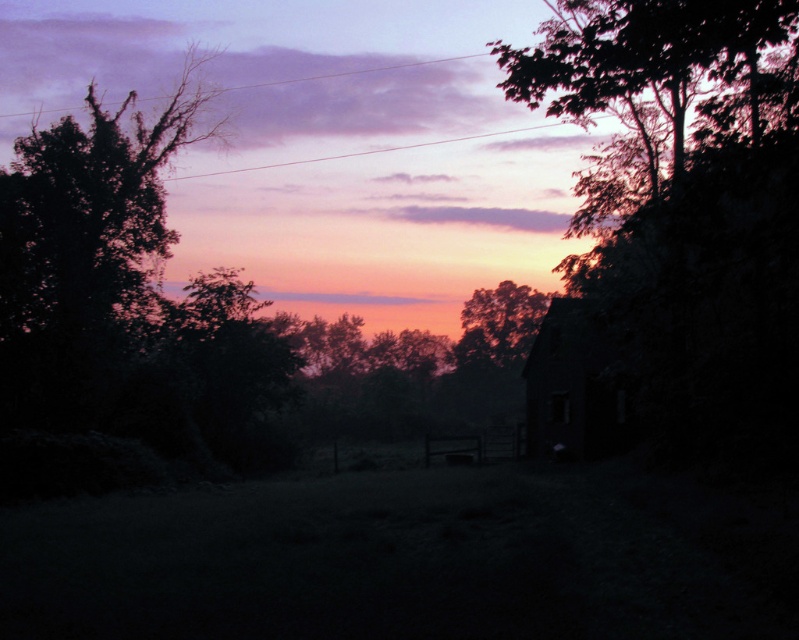
Can you confirm if silhouette leafy tree at upper right is taller than silhouetted leafy tree at center?

Yes, silhouette leafy tree at upper right is taller than silhouetted leafy tree at center.

Describe the element at coordinates (686, 204) in the screenshot. This screenshot has height=640, width=799. I see `silhouette leafy tree at upper right` at that location.

Find the location of a particular element. This screenshot has height=640, width=799. silhouette leafy tree at upper right is located at coordinates (686, 204).

Is point (93, 333) positioned after point (562, 348)?

No, it is not.

Between dark green leafy tree at left and dark brown wooden barn at right, which one appears on the left side from the viewer's perspective?

dark green leafy tree at left is more to the left.

Who is more forward, (237, 275) or (590, 304)?

Point (590, 304) is in front.

At what (x,y) coordinates should I click in order to perform the action: click on dark green leafy tree at left. Please return your answer as a coordinate pair (x, y). Looking at the image, I should click on (126, 300).

Between dark brown wooden barn at right and silhouetted leafy tree at center, which one appears on the right side from the viewer's perspective?

silhouetted leafy tree at center

What do you see at coordinates (575, 385) in the screenshot? Image resolution: width=799 pixels, height=640 pixels. I see `dark brown wooden barn at right` at bounding box center [575, 385].

Image resolution: width=799 pixels, height=640 pixels. What are the coordinates of `dark brown wooden barn at right` in the screenshot? It's located at (575, 385).